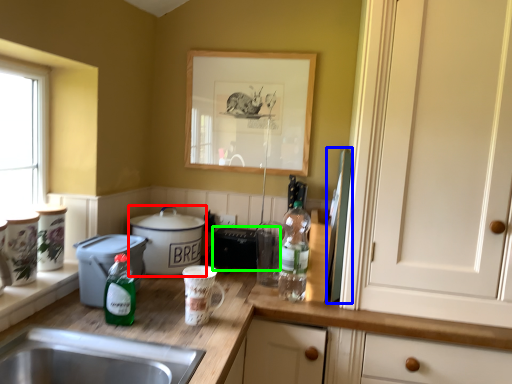
Question: Based on their relative distances, which object is nearer to cooker (highlighted by a red box)? Choose from appliance (highlighted by a blue box) and appliance (highlighted by a green box).

Choices:
 (A) appliance
 (B) appliance

Answer: (B)